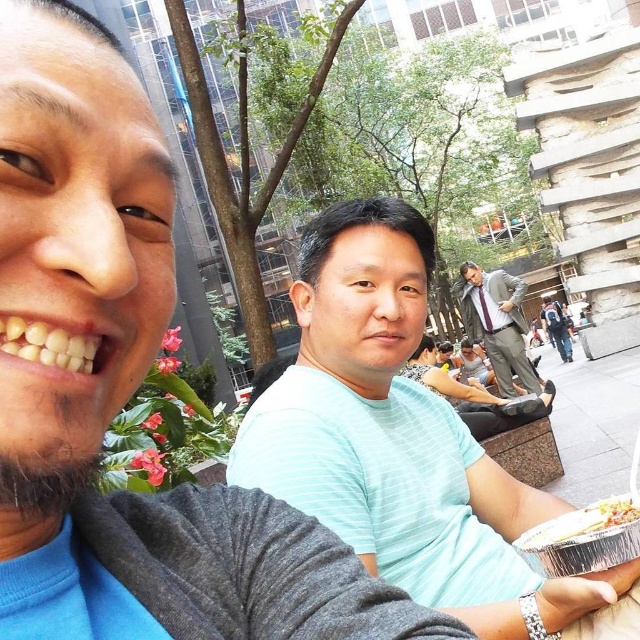
Can you confirm if light blue striped shirt at center is positioned below gray suit at center?

Correct, light blue striped shirt at center is located below gray suit at center.

Who is more distant from viewer, (589, 592) or (465, 324)?

The point (465, 324) is behind.

Between point (330, 291) and point (528, 358), which one is positioned in front?

Point (330, 291) is more forward.

Locate an element on the screen. light blue striped shirt at center is located at coordinates (401, 440).

In the scene shown: Is light blue striped shirt at center below silver foil tray at lower right?

No.

Does light blue striped shirt at center appear on the right side of silver foil tray at lower right?

Incorrect, light blue striped shirt at center is not on the right side of silver foil tray at lower right.

Does point (416, 218) come in front of point (604, 502)?

No.

The width and height of the screenshot is (640, 640). I want to click on light blue striped shirt at center, so click(401, 440).

Between gray suit at center and silver foil tray at lower right, which one appears on the left side from the viewer's perspective?

Positioned to the left is silver foil tray at lower right.

Does gray suit at center have a lesser width compared to silver foil tray at lower right?

Yes.

Find the location of a particular element. Image resolution: width=640 pixels, height=640 pixels. gray suit at center is located at coordinates (497, 323).